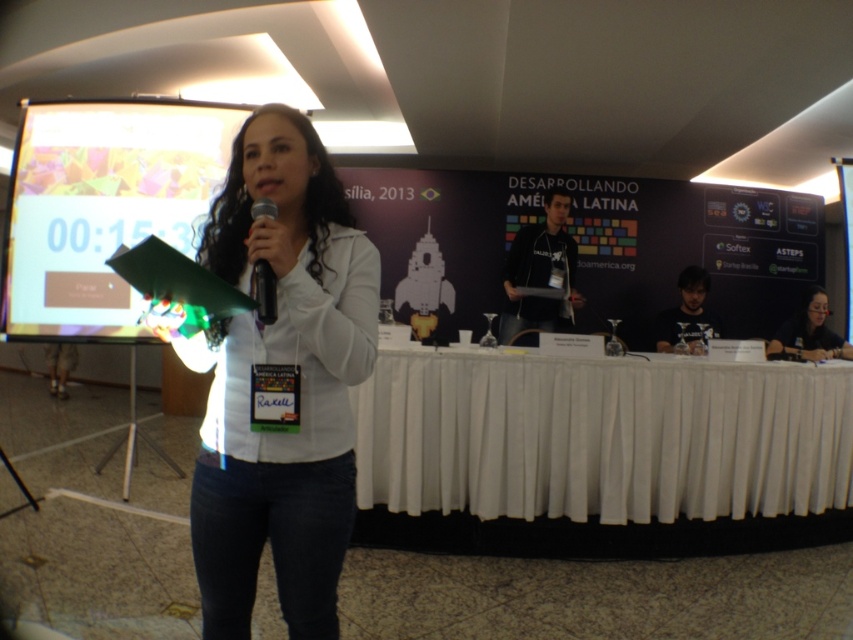
You are an event organizer who needs to place a name tag for the speaker at the front of the stage. Where should you place it in relation to the white cloth at center?

The name tag should be placed at point (601,454), which is the location of the white cloth at center as per the coordinates provided.

You are organizing a conference and need to set up a tablecloth for a presentation table. You have a white cloth at center and a matte black laptop at lower right. Which object should you use to cover the table, and why?

The white cloth at center is the appropriate choice to cover the table because it is wider than the matte black laptop at lower right, making it suitable for tablecloths which require sufficient width to drape over the edges.

You are an attendee at the conference and want to hand a document to the speaker. The document is 12 inches long. Can you determine if the white matte jacket at center is within reach of your arm extended fully? Assume your arm can reach up to 36 inches.

The white matte jacket at center is 37.12 inches from viewer, which is slightly beyond the 36 inches reach of your arm. Therefore, you cannot reach it.